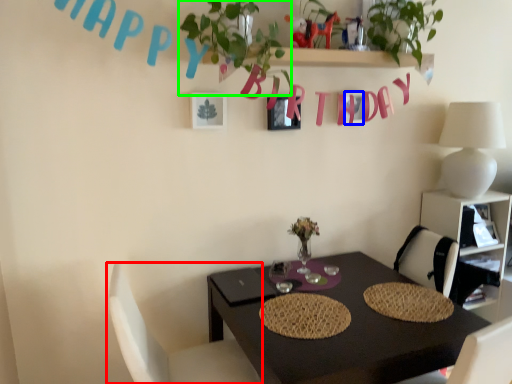
Question: Considering the real-world distances, which object is farthest from chair (highlighted by a red box)? alphabet (highlighted by a blue box) or plant (highlighted by a green box)?

Choices:
 (A) alphabet
 (B) plant

Answer: (A)